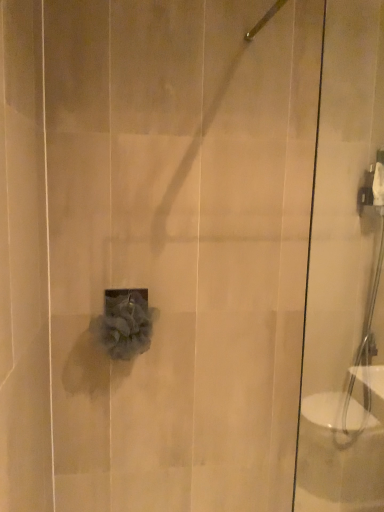
Question: From their relative heights in the image, would you say satin nickel showerhead at upper center is taller or shorter than transparent glass shower door at right?

Choices:
 (A) short
 (B) tall

Answer: (A)

Question: From a real-world perspective, is satin nickel showerhead at upper center physically located above or below transparent glass shower door at right?

Choices:
 (A) above
 (B) below

Answer: (A)

Question: Considering the real-world distances, which object is closest to the transparent glass shower door at right?

Choices:
 (A) gray fluffy loofah at center
 (B) satin nickel showerhead at upper center

Answer: (A)

Question: Based on their relative distances, which object is nearer to the satin nickel showerhead at upper center?

Choices:
 (A) gray fluffy loofah at center
 (B) transparent glass shower door at right

Answer: (B)